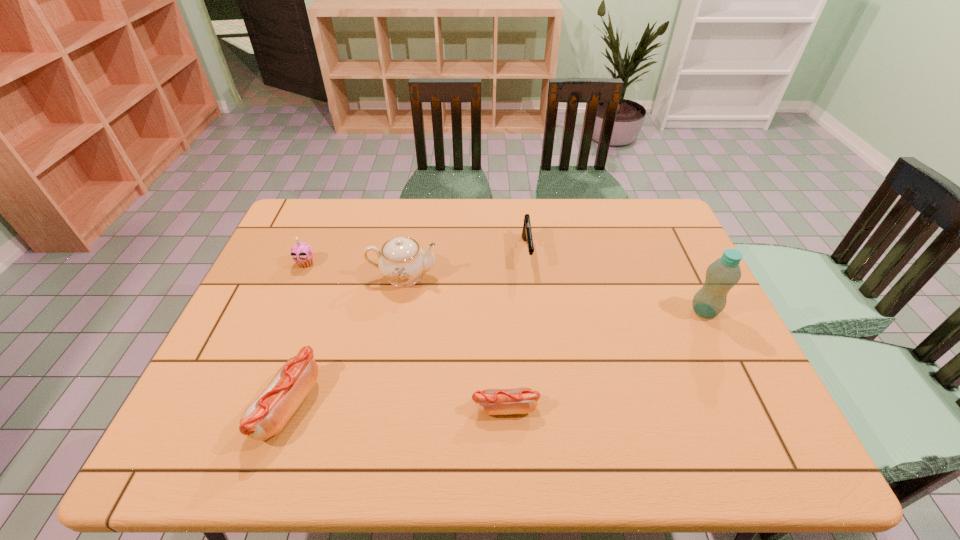
Locate an element on the screen. This screenshot has height=540, width=960. vacant space that satisfies the following two spatial constraints: 1. on the face of the cupcake; 2. on the right side of the fourth object from left to right is located at coordinates (245, 408).

Find the location of a particular element. The image size is (960, 540). free spot that satisfies the following two spatial constraints: 1. at the spout of the second tallest object; 2. on the front side of the taller sausage is located at coordinates (379, 405).